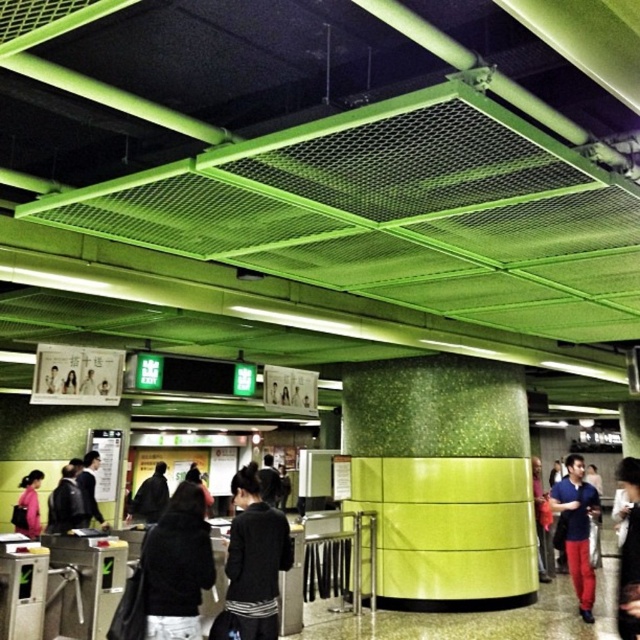
You are standing in the subway station and see two jackets hanging on adjacent hooks at the center. Which jacket is closer to you, the dark blue jacket at center or the dark gray jacket at center?

The dark blue jacket at center is closer to you because it is positioned further to the viewer than the dark gray jacket at center.